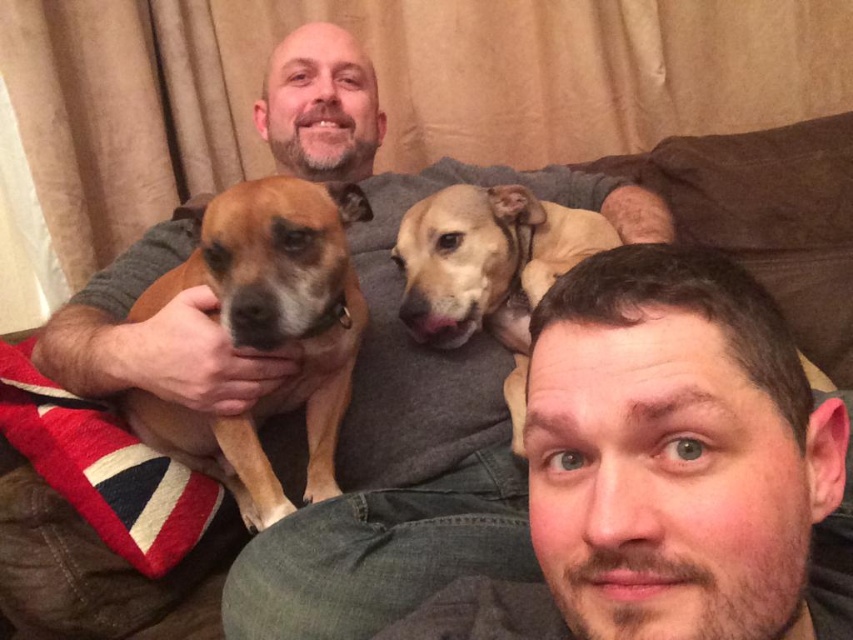
Based on the scene description, can you determine the spatial relationship between the smooth brown dog at upper center and the brown fur dog at left?

The smooth brown dog at upper center is located below the brown fur dog at left.

Consider the image. You are a delivery person who needs to place a 24 inch wide package between the smooth brown dog at upper center and the fuzzy brown dog at center on the couch. Is there enough space?

The smooth brown dog at upper center is 22.38 inches from the fuzzy brown dog at center. Since the package is 24 inches wide, which is wider than the available space, it won not fit between them.

Based on the scene description, where is the smooth brown dog at upper center located in the image?

The smooth brown dog at upper center is located at point coordinates of 0.730 on the x axis and 0.781 on the y axis.